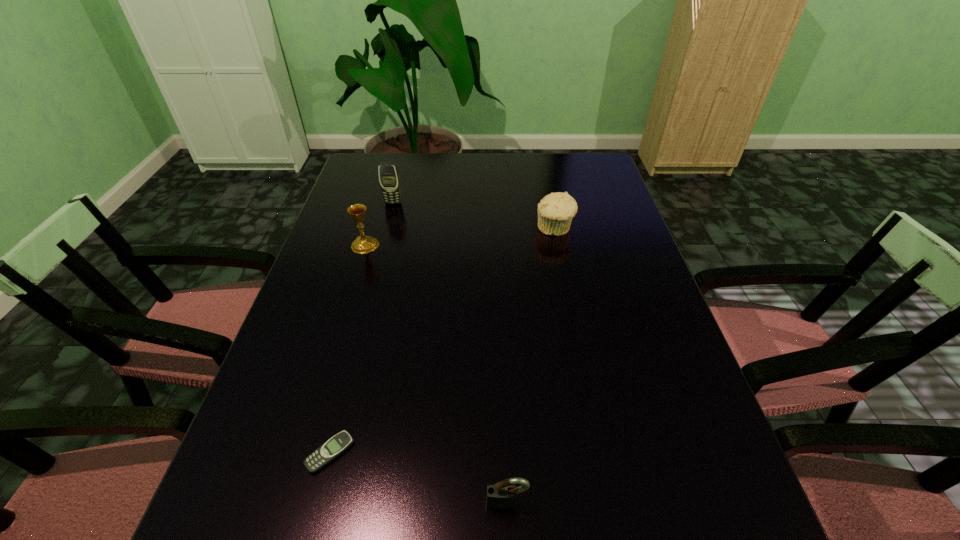
You are a GUI agent. You are given a task and a screenshot of the screen. Output one action in this format:
    pyautogui.click(x=<x>, y=<y>)
    Task: Click on the vacant area situated 0.090m on the front of the beeper
    This screenshot has height=540, width=960.
    Given the screenshot: What is the action you would take?
    pyautogui.click(x=310, y=531)

Where is `cellular telephone positioned at the left edge`? cellular telephone positioned at the left edge is located at coordinates (389, 179).

At what (x,y) coordinates should I click in order to perform the action: click on chalice present at the left edge. Please return your answer as a coordinate pair (x, y). The width and height of the screenshot is (960, 540). Looking at the image, I should click on (362, 244).

The image size is (960, 540). I want to click on beeper present at the left edge, so click(x=330, y=450).

Image resolution: width=960 pixels, height=540 pixels. Find the location of `object positioned at the right edge`. object positioned at the right edge is located at coordinates (555, 211).

The width and height of the screenshot is (960, 540). In the image, there is a desktop. Find the location of `vacant space at the far edge`. vacant space at the far edge is located at coordinates (550, 174).

Identify the location of vacant point at the left edge. (280, 500).

Locate an element on the screen. The width and height of the screenshot is (960, 540). vacant space at the right edge is located at coordinates (605, 267).

Locate an element on the screen. vacant position at the near right corner of the desktop is located at coordinates click(x=707, y=534).

Find the location of a particular element. The height and width of the screenshot is (540, 960). free space between the muffin and the fourth farthest object is located at coordinates (443, 341).